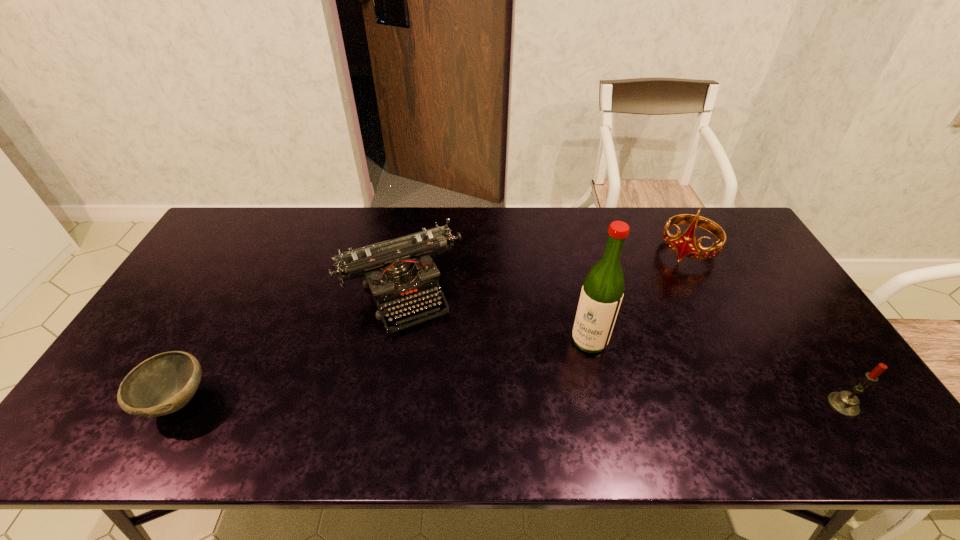
Locate an element on the screen. empty location between the third object from left to right and the fourth object from right to left is located at coordinates (495, 316).

You are a GUI agent. You are given a task and a screenshot of the screen. Output one action in this format:
    pyautogui.click(x=<x>, y=<y>)
    Task: Click on the vacant space that's between the second object from left to right and the candle
    The width and height of the screenshot is (960, 540).
    Given the screenshot: What is the action you would take?
    pyautogui.click(x=622, y=348)

Locate an element on the screen. free space between the fourth object from right to left and the candle is located at coordinates (622, 348).

Identify the location of free spot between the second object from left to right and the second tallest object. [544, 271].

Find the location of `free space between the rightmost object and the liquor`. free space between the rightmost object and the liquor is located at coordinates (716, 373).

Identify which object is located as the nearest to the tallest object. Please provide its 2D coordinates. Your answer should be formatted as a tuple, i.e. [(x, y)], where the tuple contains the x and y coordinates of a point satisfying the conditions above.

[(399, 272)]

You are a GUI agent. You are given a task and a screenshot of the screen. Output one action in this format:
    pyautogui.click(x=<x>, y=<y>)
    Task: Click on the object that is the third closest one to the bowl
    This screenshot has width=960, height=540.
    Given the screenshot: What is the action you would take?
    coord(685,245)

You are a GUI agent. You are given a task and a screenshot of the screen. Output one action in this format:
    pyautogui.click(x=<x>, y=<y>)
    Task: Click on the vacant space that satisfies the following two spatial constraints: 1. on the back side of the typewriter; 2. on the right side of the second object from right to left
    
    Given the screenshot: What is the action you would take?
    pyautogui.click(x=409, y=251)